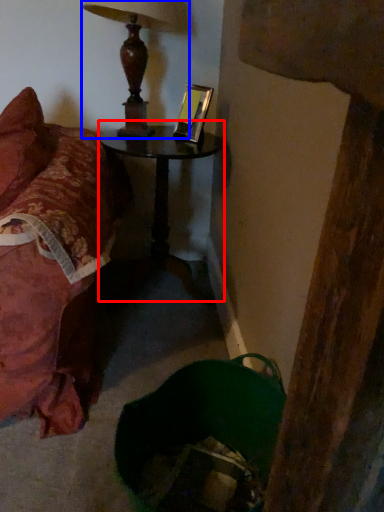
Question: Which object appears closest to the camera in this image, table (highlighted by a red box) or lamp (highlighted by a blue box)?

Choices:
 (A) table
 (B) lamp

Answer: (B)